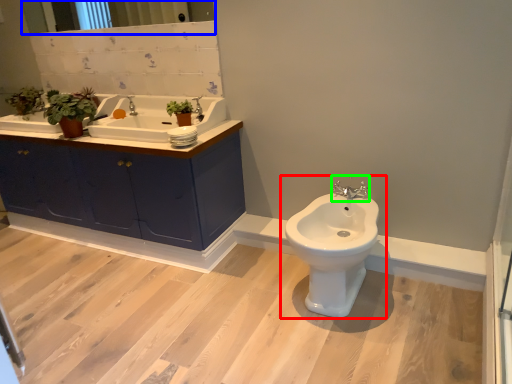
Question: Estimate the real-world distances between objects in this image. Which object is closer to toilet (highlighted by a red box), mirror (highlighted by a blue box) or tap (highlighted by a green box)?

Choices:
 (A) mirror
 (B) tap

Answer: (B)